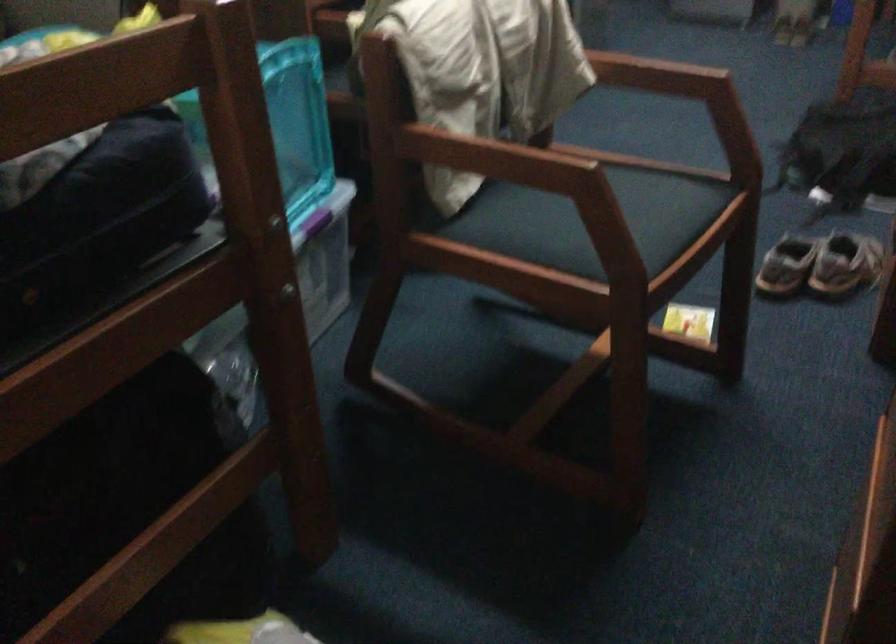
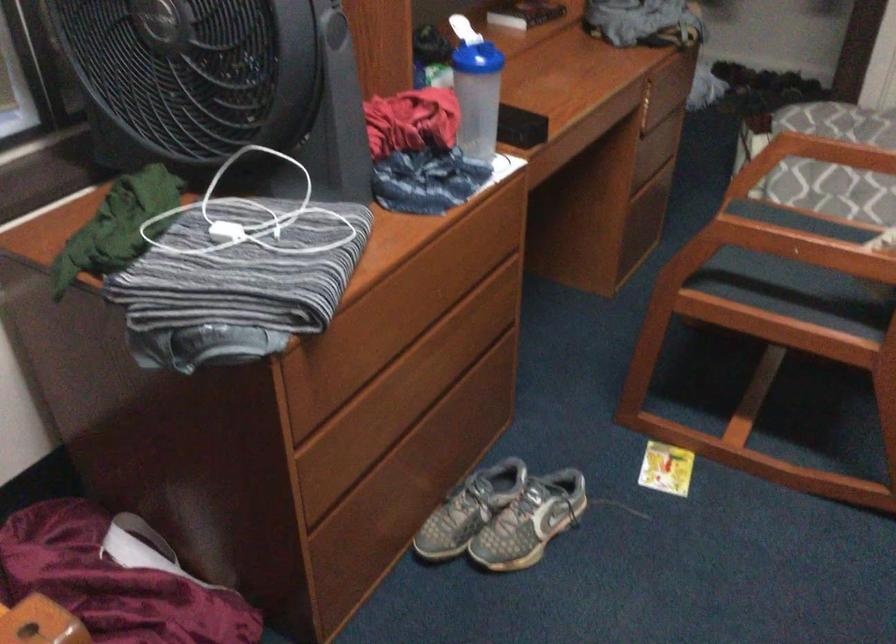
Locate, in the second image, the point that corresponds to point (825, 242) in the first image.

(503, 516)